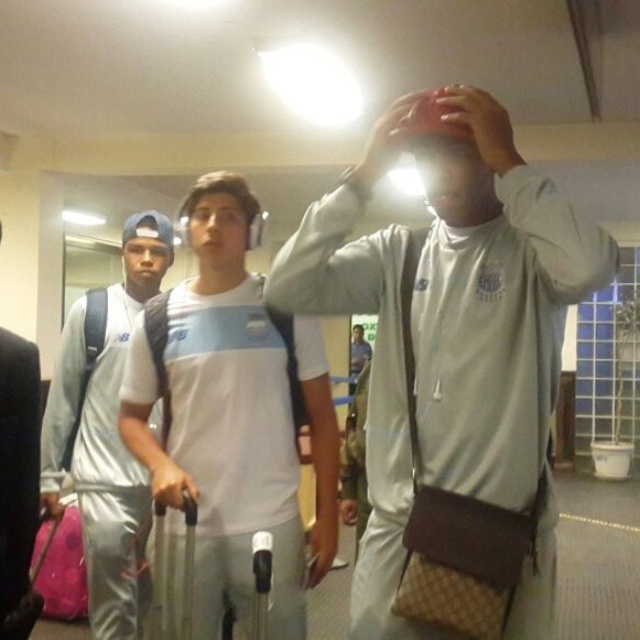
Question: Which of the following is the farthest from the observer?

Choices:
 (A) smooth skin hand at center
 (B) black leather microphone at center
 (C) white matte jacket at center

Answer: (A)

Question: Is white matte jacket at center smaller than matte black hand at upper center?

Choices:
 (A) yes
 (B) no

Answer: (B)

Question: Is white matte t-shirt at center closer to the viewer compared to black leather microphone at center?

Choices:
 (A) no
 (B) yes

Answer: (A)

Question: Which object is closer to the camera taking this photo?

Choices:
 (A) silver metallic tracksuit at left
 (B) white matte t-shirt at center
 (C) white matte jacket at center

Answer: (C)

Question: Among these points, which one is nearest to the camera?

Choices:
 (A) (266, 554)
 (B) (403, 140)
 (C) (58, 436)

Answer: (B)

Question: Can you confirm if white matte t-shirt at center is positioned to the right of black leather microphone at center?

Choices:
 (A) no
 (B) yes

Answer: (A)